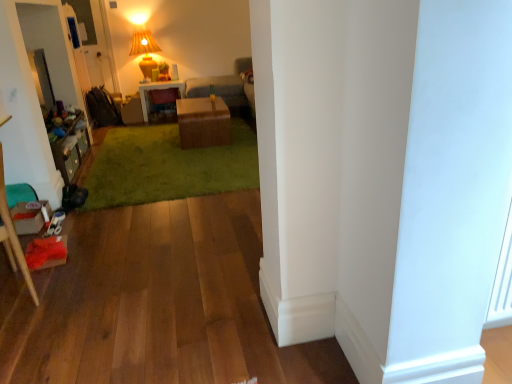
At what (x,y) coordinates should I click in order to perform the action: click on vacant area on top of green plush carpet at center (from a real-world perspective). Please return your answer as a coordinate pair (x, y). The width and height of the screenshot is (512, 384). Looking at the image, I should click on (170, 159).